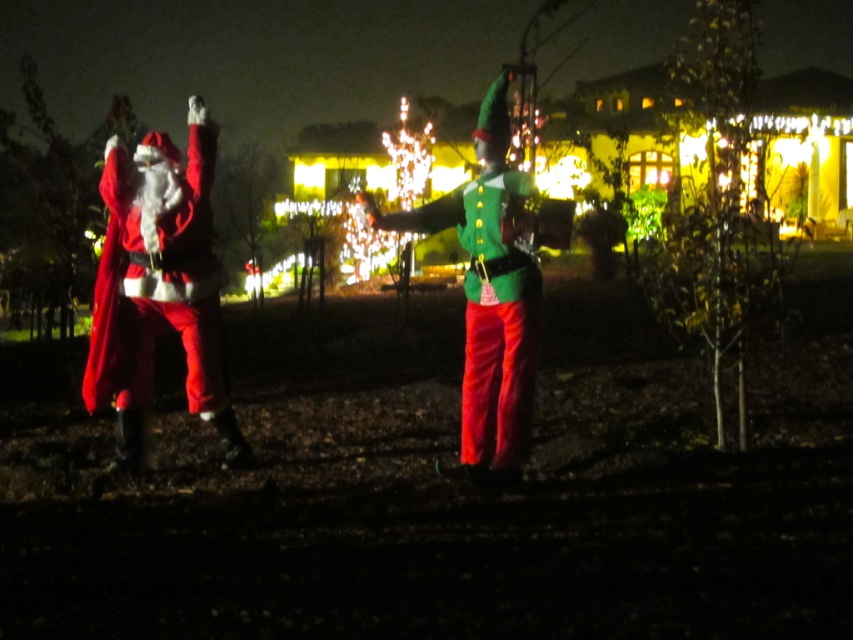
The height and width of the screenshot is (640, 853). I want to click on velvet red santa at left, so click(160, 285).

Identify the location of velvet red santa at left. (160, 285).